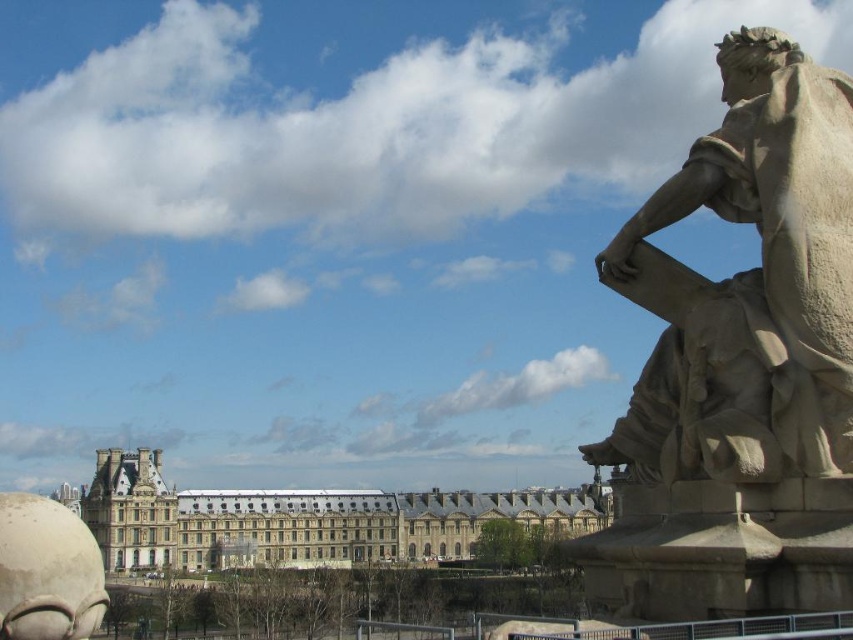
Question: Can you confirm if smooth stone statue at right is positioned to the right of stone building at center?

Choices:
 (A) yes
 (B) no

Answer: (A)

Question: Which point is closer to the camera?

Choices:
 (A) stone building at center
 (B) smooth stone statue at right

Answer: (B)

Question: Is smooth stone statue at right to the left of stone building at center from the viewer's perspective?

Choices:
 (A) yes
 (B) no

Answer: (B)

Question: Which of the following is the farthest from the observer?

Choices:
 (A) smooth stone statue at right
 (B) stone building at center

Answer: (B)

Question: Is smooth stone statue at right above stone building at center?

Choices:
 (A) no
 (B) yes

Answer: (B)

Question: Which object is farther from the camera taking this photo?

Choices:
 (A) smooth stone statue at right
 (B) stone building at center

Answer: (B)